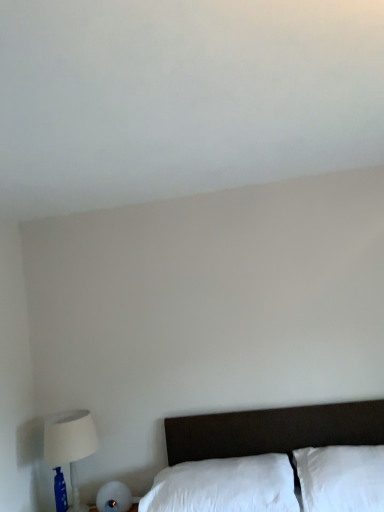
Question: Is white soft pillow at lower right, the first pillow viewed from the right, to the left or to the right of white soft pillow at lower center, the second pillow in the right-to-left sequence, in the image?

Choices:
 (A) right
 (B) left

Answer: (A)

Question: Considering the positions of white soft pillow at lower right, which is the second pillow in left-to-right order, and white soft pillow at lower center, the second pillow in the right-to-left sequence, in the image, is white soft pillow at lower right, which is the second pillow in left-to-right order, wider or thinner than white soft pillow at lower center, the second pillow in the right-to-left sequence,?

Choices:
 (A) thin
 (B) wide

Answer: (A)

Question: Which object is the closest to the white soft pillow at lower right, the first pillow viewed from the right?

Choices:
 (A) white soft pillow at lower center, positioned as the 1th pillow in left-to-right order
 (B) white fabric lampshade at left

Answer: (A)

Question: Estimate the real-world distances between objects in this image. Which object is farther from the white soft pillow at lower center, positioned as the 1th pillow in left-to-right order?

Choices:
 (A) white fabric lampshade at left
 (B) white soft pillow at lower right, the first pillow viewed from the right

Answer: (A)